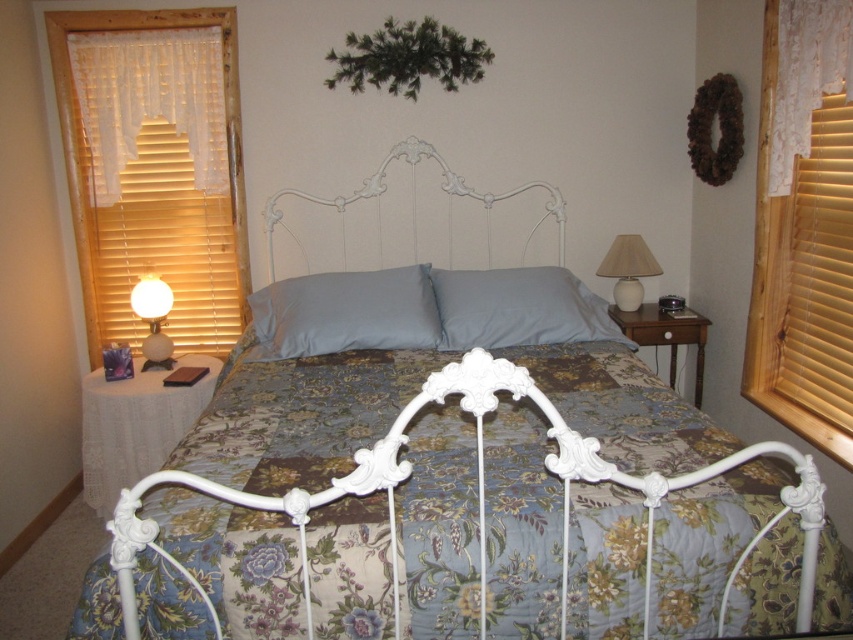
Question: Does light blue fabric pillow at center have a greater width compared to white sheer curtain at right?

Choices:
 (A) yes
 (B) no

Answer: (A)

Question: Where is floral fabric bed at center located in relation to matte white glass lamp at left in the image?

Choices:
 (A) above
 (B) below

Answer: (B)

Question: In this image, where is floral fabric bed at center located relative to white wrought iron headboard at center?

Choices:
 (A) above
 (B) below

Answer: (B)

Question: Which object is farther from the camera taking this photo?

Choices:
 (A) white sheer curtain at right
 (B) wooden blinds at left

Answer: (B)

Question: Based on their relative distances, which object is nearer to the wooden blinds at right?

Choices:
 (A) matte white glass lamp at left
 (B) white ceramic lamp at right

Answer: (B)

Question: Which point appears closest to the camera in this image?

Choices:
 (A) (161, 365)
 (B) (791, 248)
 (C) (267, 221)
 (D) (618, 269)

Answer: (B)